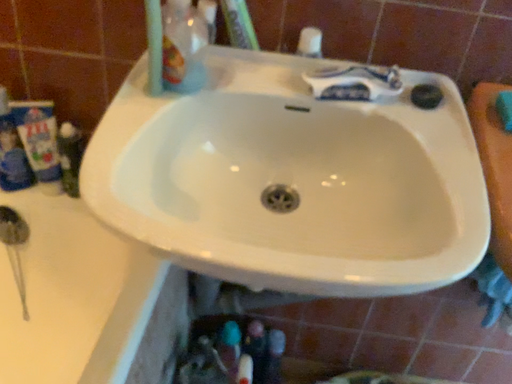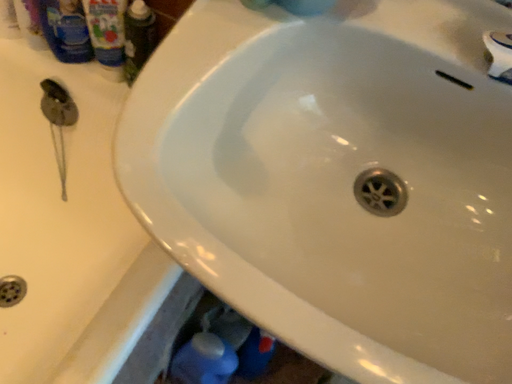
Question: Which way did the camera rotate in the video?

Choices:
 (A) rotated right
 (B) rotated left

Answer: (B)